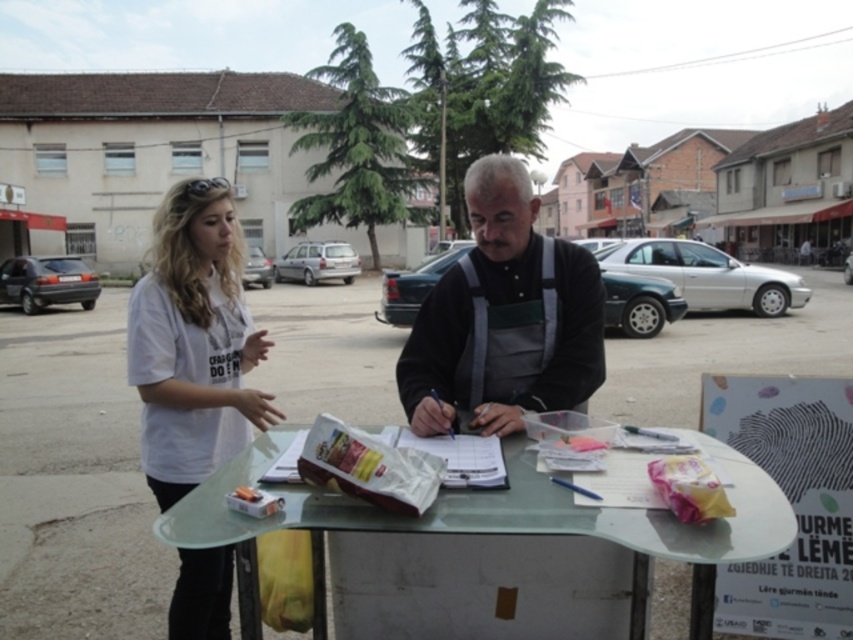
Question: Does white t-shirt at left lie in front of dark gray fabric vest at center?

Choices:
 (A) no
 (B) yes

Answer: (B)

Question: Estimate the real-world distances between objects in this image. Which object is farther from the white t-shirt at left?

Choices:
 (A) dark gray fabric vest at center
 (B) white cotton shirt at left
 (C) clear glass table at center

Answer: (B)

Question: Is white t-shirt at left positioned before dark gray fabric vest at center?

Choices:
 (A) yes
 (B) no

Answer: (A)

Question: Does clear glass table at center appear on the right side of dark gray fabric vest at center?

Choices:
 (A) yes
 (B) no

Answer: (B)

Question: Which point is closer to the camera?

Choices:
 (A) white t-shirt at left
 (B) dark gray fabric vest at center
 (C) clear glass table at center
 (D) white cotton shirt at left

Answer: (C)

Question: Estimate the real-world distances between objects in this image. Which object is farther from the white t-shirt at left?

Choices:
 (A) clear glass table at center
 (B) white cotton shirt at left
 (C) dark gray fabric vest at center

Answer: (B)